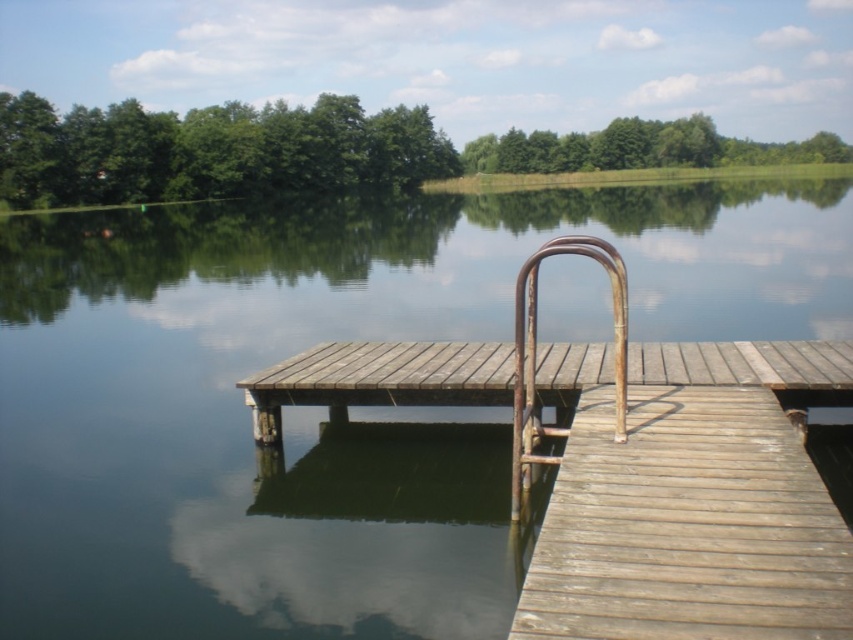
Can you confirm if weathered wood dock at center is thinner than rusty metal rail at center?

No.

In order to click on weathered wood dock at center in this screenshot , I will do `click(535, 372)`.

Who is higher up, transparent water at center or rusty metal rail at center?

transparent water at center

Identify the location of transparent water at center. Image resolution: width=853 pixels, height=640 pixels. pyautogui.click(x=323, y=406).

Between transparent water at center and weathered wood dock at center, which one has less height?

weathered wood dock at center

Describe the element at coordinates (323, 406) in the screenshot. The height and width of the screenshot is (640, 853). I see `transparent water at center` at that location.

Where is `transparent water at center`? This screenshot has width=853, height=640. transparent water at center is located at coordinates (x=323, y=406).

The image size is (853, 640). Find the location of `transparent water at center`. transparent water at center is located at coordinates (323, 406).